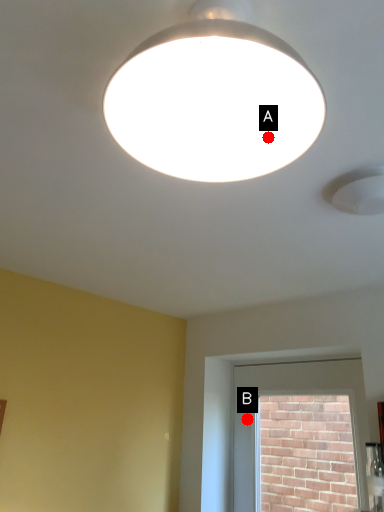
Question: Two points are circled on the image, labeled by A and B beside each circle. Which of the following is the closest to the observer?

Choices:
 (A) A is closer
 (B) B is closer

Answer: (A)